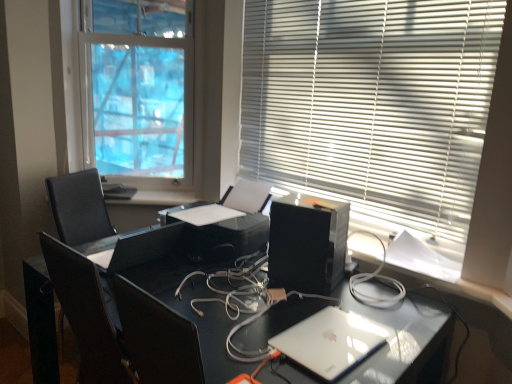
The height and width of the screenshot is (384, 512). I want to click on free space above satin black desk at center (from a real-world perspective), so click(267, 299).